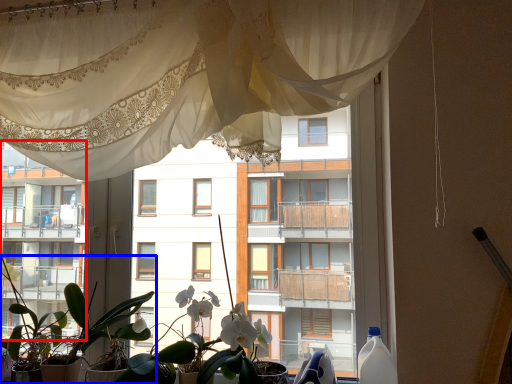
Question: Which object appears farthest to the camera in this image, condominium (highlighted by a red box) or houseplant (highlighted by a blue box)?

Choices:
 (A) condominium
 (B) houseplant

Answer: (A)